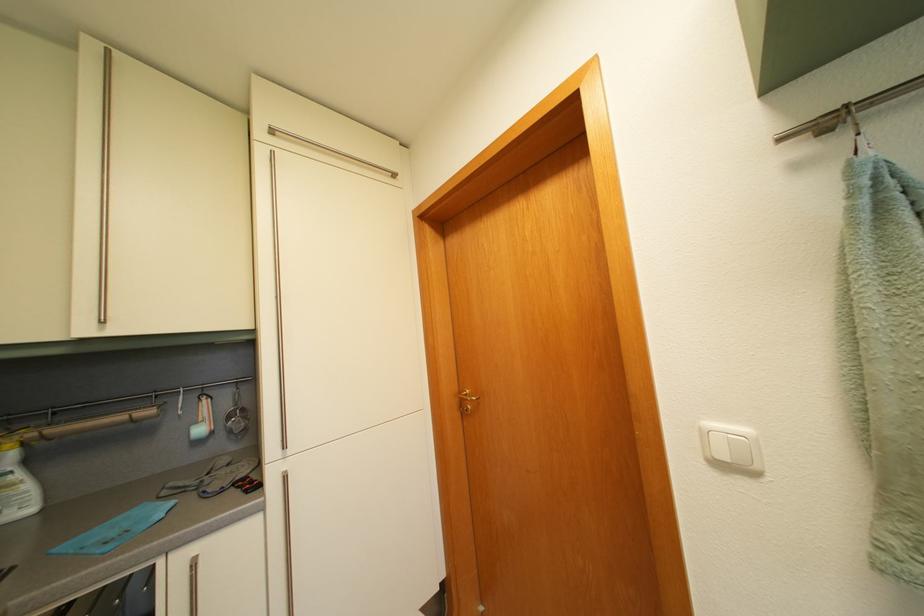
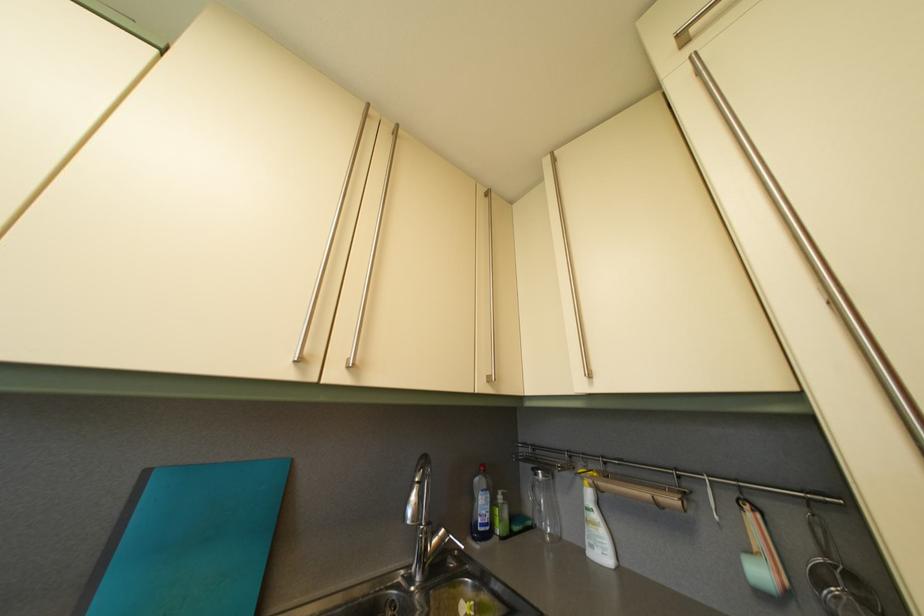
In the second image, find the point that corresponds to pixel 99 52 in the first image.

(554, 169)